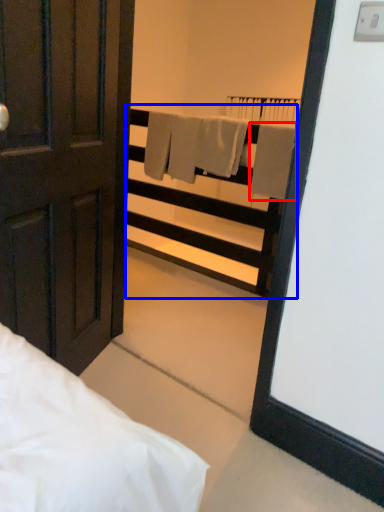
Question: Which object appears closest to the camera in this image, bath towel (highlighted by a red box) or balustrade (highlighted by a blue box)?

Choices:
 (A) bath towel
 (B) balustrade

Answer: (A)